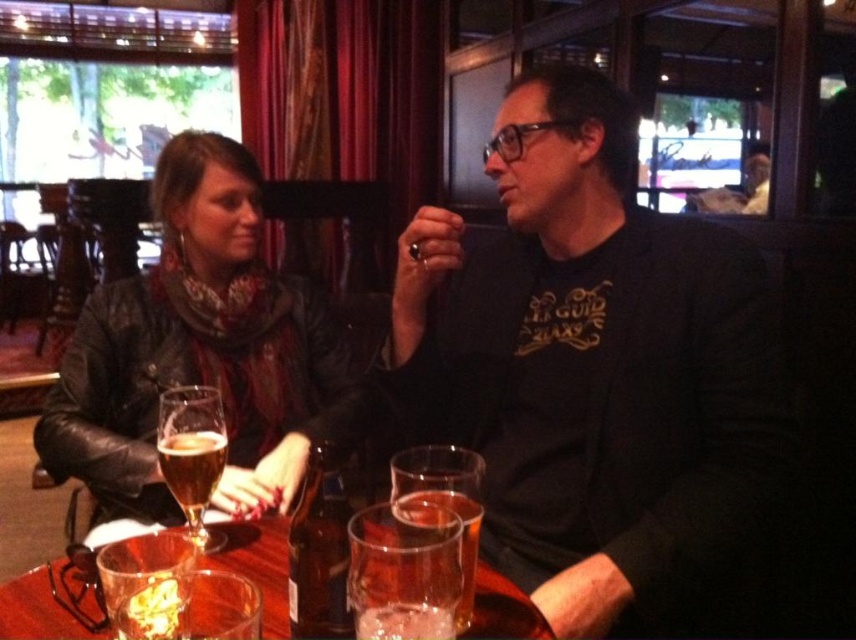
Does leather jacket at left have a larger size compared to clear glass wine glass at center?

Yes.

Between point (276, 397) and point (394, 620), which one is positioned in front?

Positioned in front is point (394, 620).

Is point (156, 461) more distant than point (431, 593)?

Yes, point (156, 461) is farther from viewer.

Where is `leather jacket at left`? leather jacket at left is located at coordinates (197, 353).

Is leather jacket at left to the right of clear glass beer at center from the viewer's perspective?

No, leather jacket at left is not to the right of clear glass beer at center.

Does leather jacket at left come behind clear glass beer at center?

Yes.

Which is in front, point (188, 353) or point (423, 605)?

Point (423, 605) is more forward.

At what (x,y) coordinates should I click in order to perform the action: click on leather jacket at left. Please return your answer as a coordinate pair (x, y). Looking at the image, I should click on (197, 353).

From the picture: Is the position of clear glass wine glass at center more distant than that of translucent glass beer at left?

No.

Is point (360, 600) closer to camera compared to point (218, 464)?

Yes, point (360, 600) is in front of point (218, 464).

Between point (375, 618) and point (226, 440), which one is positioned behind?

The point (226, 440) is more distant.

Find the location of a particular element. clear glass wine glass at center is located at coordinates (403, 572).